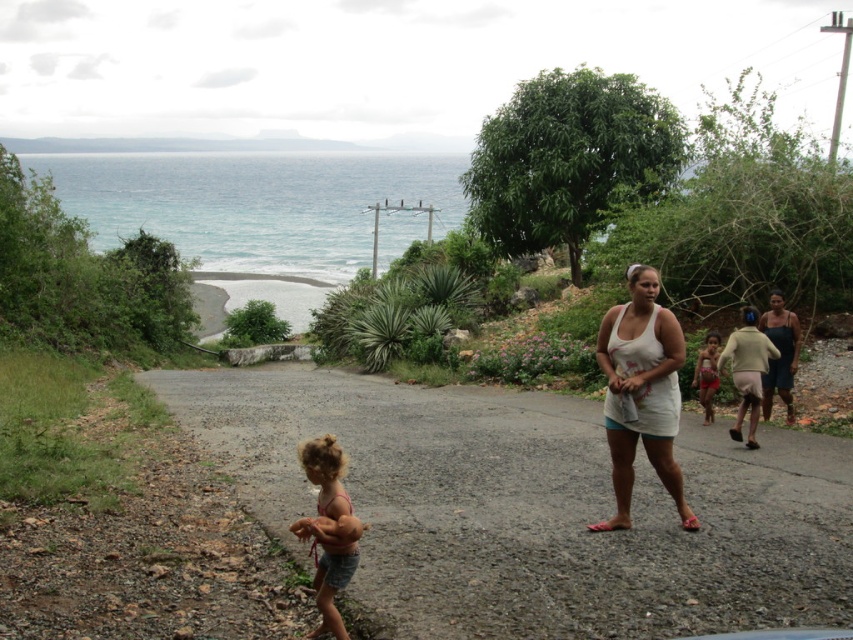
Who is taller, white cotton tank top at center or curly blonde hair at lower left?

white cotton tank top at center

Is white cotton tank top at center closer to the viewer compared to curly blonde hair at lower left?

No, it is not.

Who is more distant from viewer, (682, 355) or (347, 531)?

Point (682, 355)

Where is `white cotton tank top at center`? white cotton tank top at center is located at coordinates (641, 392).

Who is taller, curly blonde hair at lower left or red fabric shorts at center?

Standing taller between the two is red fabric shorts at center.

From the picture: Measure the distance between curly blonde hair at lower left and red fabric shorts at center.

They are 27.00 feet apart.

Is point (335, 465) positioned before point (693, 378)?

Yes, it is in front of point (693, 378).

This screenshot has width=853, height=640. I want to click on curly blonde hair at lower left, so click(329, 529).

Is white cotton tank top at center to the right of red fabric shorts at center from the viewer's perspective?

In fact, white cotton tank top at center is to the left of red fabric shorts at center.

Which is above, white cotton tank top at center or red fabric shorts at center?

white cotton tank top at center is above.

Locate an element on the screen. white cotton tank top at center is located at coordinates (641, 392).